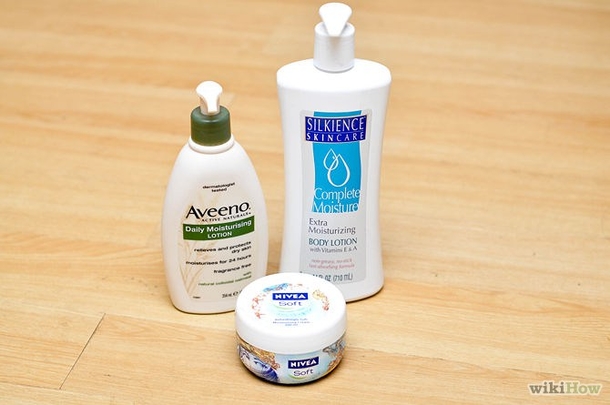
Find the location of a particular element. bottle of lotion is located at coordinates 224,196, 340,167.